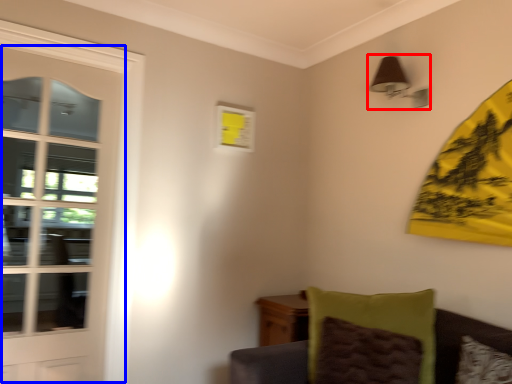
Question: Which point is closer to the camera, light fixture (highlighted by a red box) or door (highlighted by a blue box)?

Choices:
 (A) light fixture
 (B) door

Answer: (B)